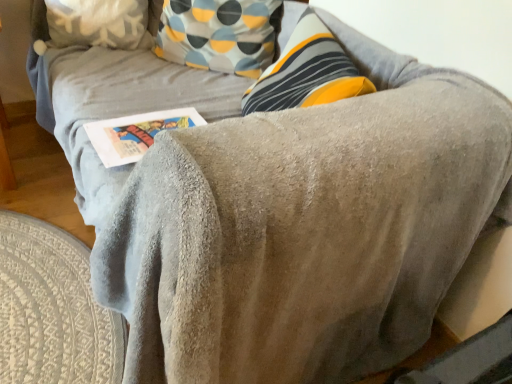
Identify the location of blank space situated above white paper at center (from a real-world perspective). The height and width of the screenshot is (384, 512). (143, 130).